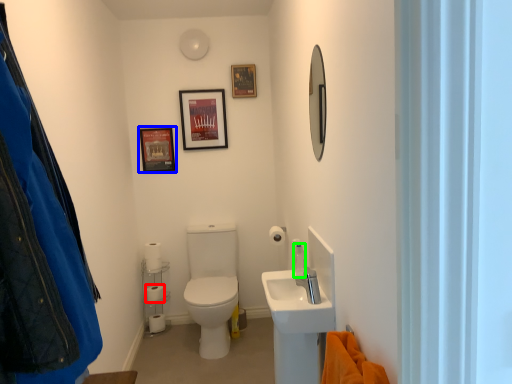
Question: Which is farther away from toilet paper (highlighted by a red box)? picture frame (highlighted by a blue box) or toiletry (highlighted by a green box)?

Choices:
 (A) picture frame
 (B) toiletry

Answer: (B)